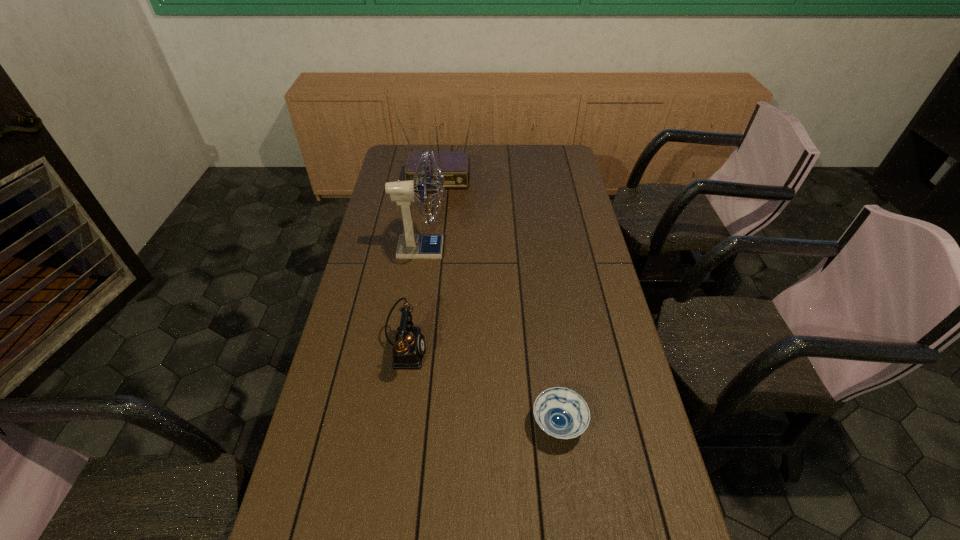
Where is `the closest object relative to the soup bowl`? The image size is (960, 540). the closest object relative to the soup bowl is located at coordinates (408, 351).

Locate an element on the screen. The width and height of the screenshot is (960, 540). free spot that satisfies the following two spatial constraints: 1. on the front of the soup bowl at the rotary dial; 2. on the right side of the telephone is located at coordinates (396, 424).

Where is `free space in the image that satisfies the following two spatial constraints: 1. on the front of the telephone at the rotary dial; 2. on the left side of the shortest object`? The width and height of the screenshot is (960, 540). free space in the image that satisfies the following two spatial constraints: 1. on the front of the telephone at the rotary dial; 2. on the left side of the shortest object is located at coordinates (396, 424).

Image resolution: width=960 pixels, height=540 pixels. I want to click on blank area in the image that satisfies the following two spatial constraints: 1. on the front-facing side of the soup bowl; 2. on the left side of the fan, so click(397, 424).

Locate an element on the screen. free location that satisfies the following two spatial constraints: 1. on the front panel of the nearest object; 2. on the left side of the second tallest object is located at coordinates (406, 424).

The width and height of the screenshot is (960, 540). Find the location of `free location that satisfies the following two spatial constraints: 1. on the front of the second shortest object at the rotary dial; 2. on the back side of the rightmost object`. free location that satisfies the following two spatial constraints: 1. on the front of the second shortest object at the rotary dial; 2. on the back side of the rightmost object is located at coordinates (396, 424).

Identify the location of blank area in the image that satisfies the following two spatial constraints: 1. on the front-facing side of the shortest object; 2. on the right side of the second farthest object. (397, 424).

Locate an element on the screen. The image size is (960, 540). free spot that satisfies the following two spatial constraints: 1. on the front of the second nearest object at the rotary dial; 2. on the right side of the soup bowl is located at coordinates (396, 424).

This screenshot has height=540, width=960. Identify the location of free space that satisfies the following two spatial constraints: 1. on the back side of the shortest object; 2. on the front-facing side of the third nearest object. (535, 249).

Locate an element on the screen. Image resolution: width=960 pixels, height=540 pixels. free point that satisfies the following two spatial constraints: 1. on the front panel of the soup bowl; 2. on the left side of the second tallest object is located at coordinates click(406, 424).